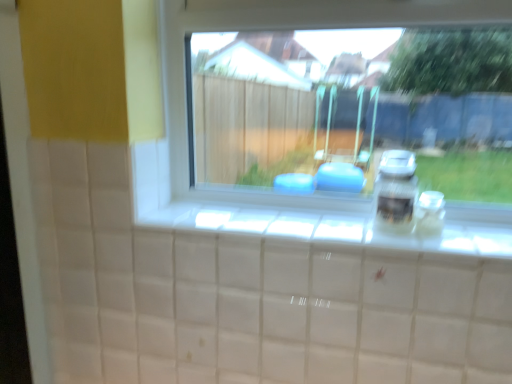
Question: Does transparent glass jar at right appear on the left side of satin silver jar at right?

Choices:
 (A) no
 (B) yes

Answer: (A)

Question: Considering the relative positions of transparent glass jar at right and satin silver jar at right in the image provided, is transparent glass jar at right in front of satin silver jar at right?

Choices:
 (A) yes
 (B) no

Answer: (B)

Question: Is transparent glass jar at right directly adjacent to satin silver jar at right?

Choices:
 (A) yes
 (B) no

Answer: (A)

Question: Could you tell me if transparent glass jar at right is facing satin silver jar at right?

Choices:
 (A) no
 (B) yes

Answer: (A)

Question: Is transparent glass jar at right positioned with its back to satin silver jar at right?

Choices:
 (A) no
 (B) yes

Answer: (A)

Question: Can you confirm if transparent glass jar at right is smaller than satin silver jar at right?

Choices:
 (A) no
 (B) yes

Answer: (B)

Question: Is satin silver jar at right oriented towards transparent glass jar at right?

Choices:
 (A) yes
 (B) no

Answer: (B)

Question: Can you confirm if satin silver jar at right is bigger than transparent glass jar at right?

Choices:
 (A) no
 (B) yes

Answer: (B)

Question: Is satin silver jar at right far away from transparent glass jar at right?

Choices:
 (A) no
 (B) yes

Answer: (A)

Question: Is satin silver jar at right further to the viewer compared to transparent glass jar at right?

Choices:
 (A) no
 (B) yes

Answer: (A)

Question: From the image's perspective, is satin silver jar at right located above transparent glass jar at right?

Choices:
 (A) no
 (B) yes

Answer: (B)

Question: Is satin silver jar at right shorter than transparent glass jar at right?

Choices:
 (A) yes
 (B) no

Answer: (B)

Question: Does transparent glass window at center contain transparent glass jar at right?

Choices:
 (A) no
 (B) yes

Answer: (A)